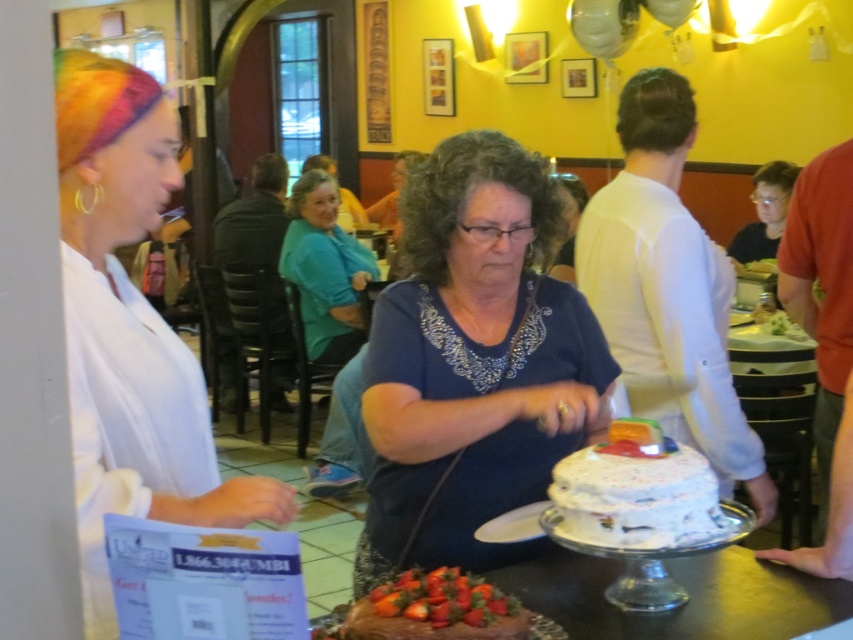
Question: Does white frosted cake at center have a lesser width compared to teal fabric shirt at center?

Choices:
 (A) yes
 (B) no

Answer: (A)

Question: Does white frosted cake at center appear on the right side of smooth chocolate cake at center?

Choices:
 (A) yes
 (B) no

Answer: (B)

Question: Which of the following is the closest to the observer?

Choices:
 (A) blue fabric shirt at center
 (B) smooth chocolate cake at center
 (C) white matte paper at left
 (D) chocolate frosted cake at center

Answer: (C)

Question: Can you confirm if blue fabric shirt at center is thinner than white matte paper at left?

Choices:
 (A) yes
 (B) no

Answer: (B)

Question: Estimate the real-world distances between objects in this image. Which object is closer to the white frosted cake at center?

Choices:
 (A) white matte paper at left
 (B) smooth chocolate cake at center
 (C) teal fabric shirt at center

Answer: (B)

Question: Which object is the closest to the white matte paper at left?

Choices:
 (A) teal fabric shirt at center
 (B) blue fabric shirt at center
 (C) white frosted cake at center

Answer: (B)